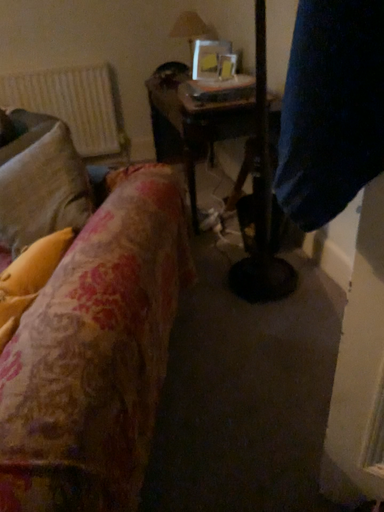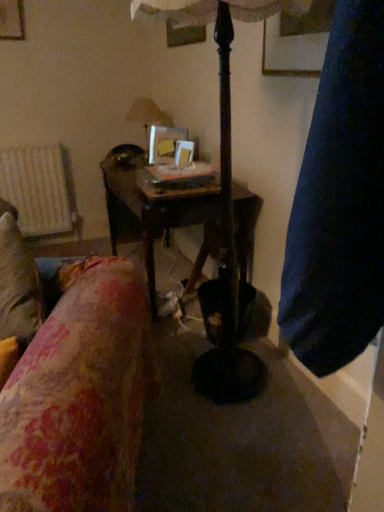
Question: How did the camera likely rotate when shooting the video?

Choices:
 (A) rotated upward
 (B) rotated downward

Answer: (A)